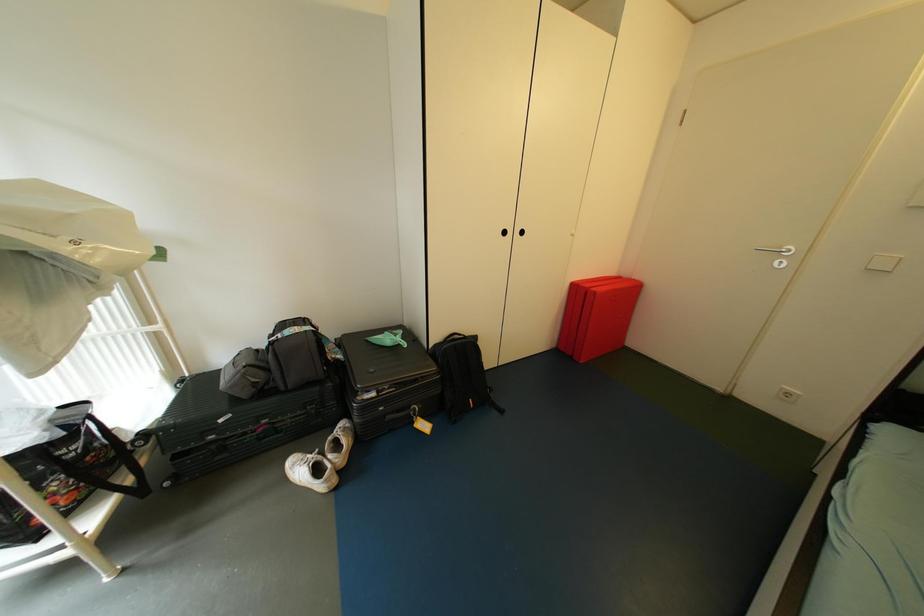
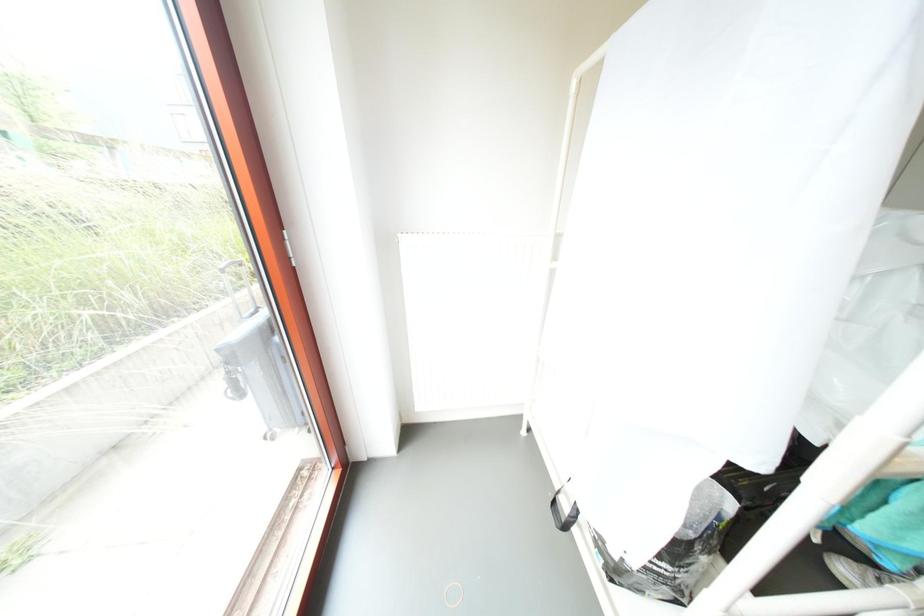
Question: Which direction would the cameraman need to move to produce the second image? Reply with the corresponding letter.

Choices:
 (A) Left
 (B) Right
 (C) Forward
 (D) Backward

Answer: (A)